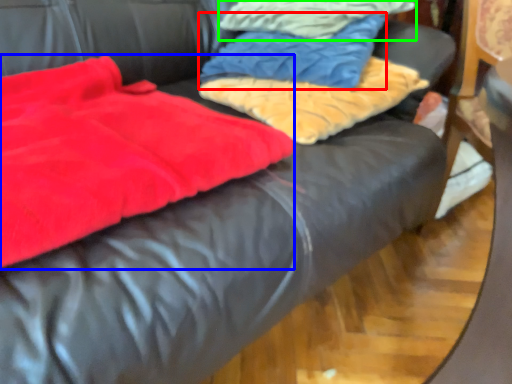
Question: Which object is the closest to the cloth (highlighted by a red box)? Choose among these: blanket (highlighted by a blue box) or cloth (highlighted by a green box).

Choices:
 (A) blanket
 (B) cloth

Answer: (B)